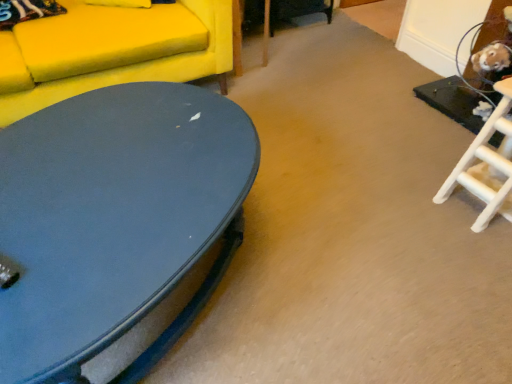
Where is `vacant area to the right of matte yellow fabric couch at upper left`? vacant area to the right of matte yellow fabric couch at upper left is located at coordinates (304, 98).